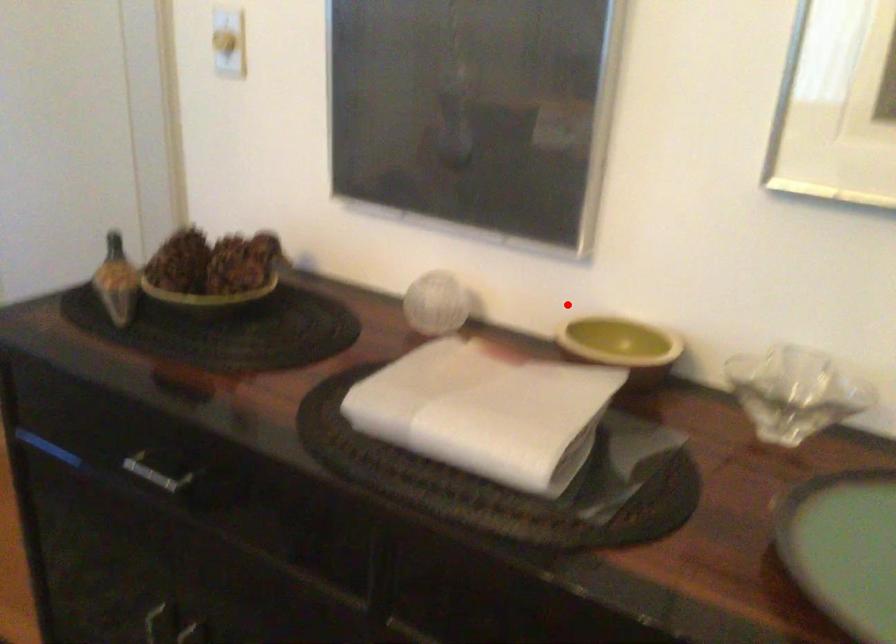
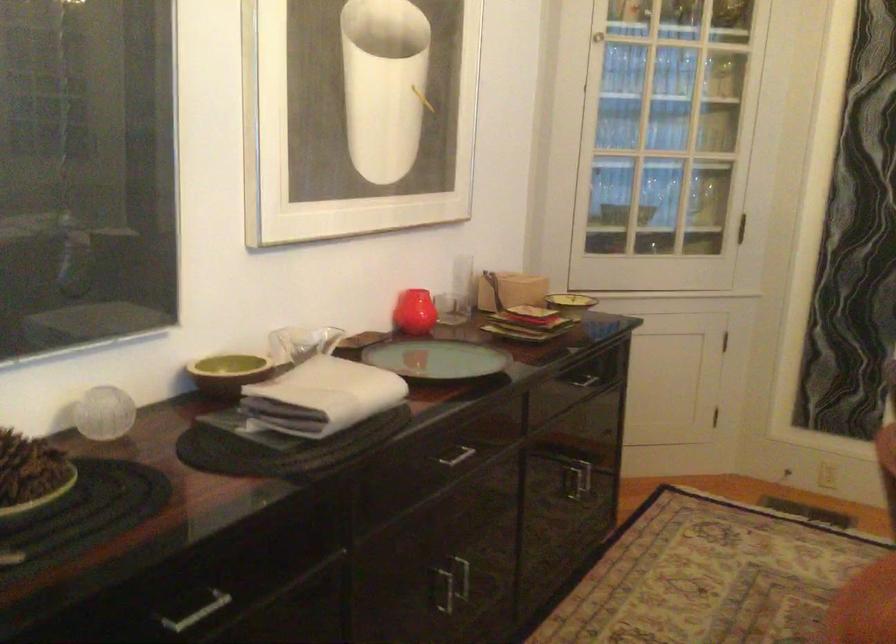
Where in the second image is the point corresponding to the highlighted location from the first image?

(228, 373)